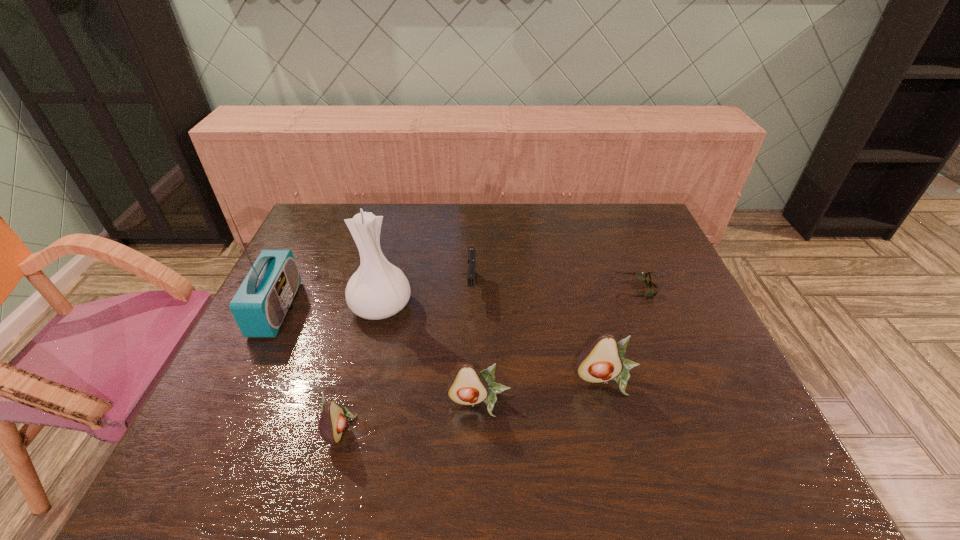
At what (x,y) coordinates should I click in order to perform the action: click on free region at the far edge. Please return your answer as a coordinate pair (x, y). Image resolution: width=960 pixels, height=540 pixels. Looking at the image, I should click on (409, 218).

In the image, there is a desktop. Where is `vacant region at the left edge`? vacant region at the left edge is located at coordinates (322, 285).

You are a GUI agent. You are given a task and a screenshot of the screen. Output one action in this format:
    pyautogui.click(x=<x>, y=<y>)
    Task: Click on the vacant space at the right edge
    Image resolution: width=960 pixels, height=540 pixels.
    Given the screenshot: What is the action you would take?
    pyautogui.click(x=700, y=353)

Where is `free region at the far right corner of the desktop`? free region at the far right corner of the desktop is located at coordinates (612, 207).

Find the location of `free space that is in between the sixth object from left to right and the sixth shortest object`. free space that is in between the sixth object from left to right and the sixth shortest object is located at coordinates coord(494,343).

The height and width of the screenshot is (540, 960). Identify the location of unoccupied area between the leftmost avocado and the radio receiver. (308, 368).

You are a GUI agent. You are given a task and a screenshot of the screen. Output one action in this format:
    pyautogui.click(x=<x>, y=<y>)
    Task: Click on the vacant space that is in between the second tallest object and the leftmost object
    This screenshot has width=960, height=540.
    Given the screenshot: What is the action you would take?
    (328, 308)

Where is `free space between the radio receiver and the second object from right to left`? The height and width of the screenshot is (540, 960). free space between the radio receiver and the second object from right to left is located at coordinates (442, 345).

Where is `vacant space that is in between the sixth tallest object and the shortest avocado`? The width and height of the screenshot is (960, 540). vacant space that is in between the sixth tallest object and the shortest avocado is located at coordinates (406, 357).

The width and height of the screenshot is (960, 540). Identify the location of empty space between the fourth tallest object and the rightmost avocado. (543, 392).